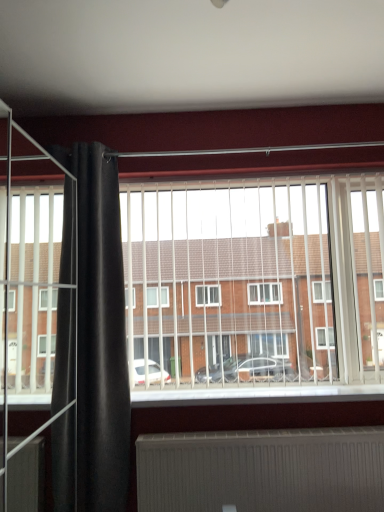
Question: Is black velvet curtain at left with white plastic blinds at center?

Choices:
 (A) no
 (B) yes

Answer: (A)

Question: Can you confirm if black velvet curtain at left is bigger than white plastic blinds at center?

Choices:
 (A) yes
 (B) no

Answer: (B)

Question: Does black velvet curtain at left appear on the left side of white plastic blinds at center?

Choices:
 (A) yes
 (B) no

Answer: (A)

Question: Is black velvet curtain at left thinner than white plastic blinds at center?

Choices:
 (A) no
 (B) yes

Answer: (A)

Question: Considering the relative positions of black velvet curtain at left and white plastic blinds at center in the image provided, is black velvet curtain at left to the right of white plastic blinds at center from the viewer's perspective?

Choices:
 (A) yes
 (B) no

Answer: (B)

Question: Is point (172, 475) closer or farther from the camera than point (14, 382)?

Choices:
 (A) closer
 (B) farther

Answer: (A)

Question: Considering their positions, is white ribbed radiator at lower center located in front of or behind white plastic blinds at center?

Choices:
 (A) front
 (B) behind

Answer: (A)

Question: From the image's perspective, is white ribbed radiator at lower center positioned above or below white plastic blinds at center?

Choices:
 (A) above
 (B) below

Answer: (B)

Question: Is white ribbed radiator at lower center wider or thinner than white plastic blinds at center?

Choices:
 (A) thin
 (B) wide

Answer: (A)

Question: Looking at the image, does black velvet curtain at left seem bigger or smaller compared to white plastic blinds at center?

Choices:
 (A) big
 (B) small

Answer: (B)

Question: From a real-world perspective, is black velvet curtain at left physically located above or below white plastic blinds at center?

Choices:
 (A) above
 (B) below

Answer: (B)

Question: Choose the correct answer: Is black velvet curtain at left inside white plastic blinds at center or outside it?

Choices:
 (A) outside
 (B) inside

Answer: (A)

Question: Considering the positions of black velvet curtain at left and white plastic blinds at center in the image, is black velvet curtain at left wider or thinner than white plastic blinds at center?

Choices:
 (A) thin
 (B) wide

Answer: (B)

Question: From a real-world perspective, is white plastic blinds at center positioned above or below white ribbed radiator at lower center?

Choices:
 (A) below
 (B) above

Answer: (B)

Question: Is white plastic blinds at center taller or shorter than white ribbed radiator at lower center?

Choices:
 (A) short
 (B) tall

Answer: (B)